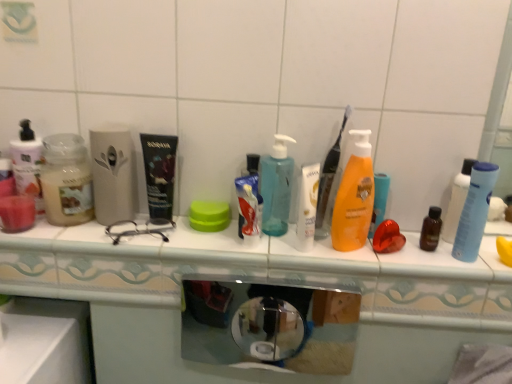
The image size is (512, 384). I want to click on vacant space to the right of dark blue plastic tube at center, so click(233, 243).